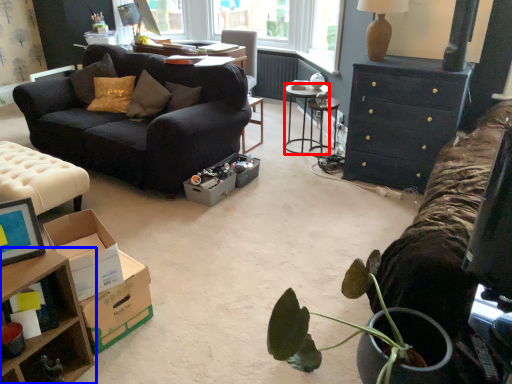
Question: Among these objects, which one is farthest to the camera, desk (highlighted by a red box) or table (highlighted by a blue box)?

Choices:
 (A) desk
 (B) table

Answer: (A)